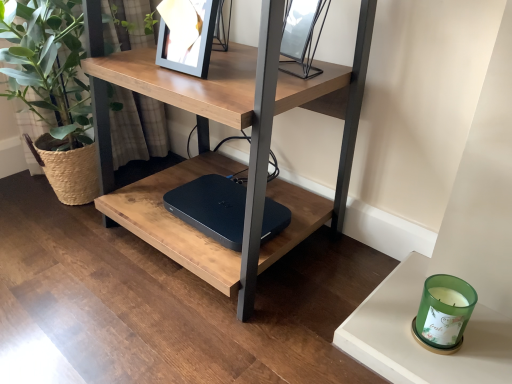
Find the location of a particular element. free spot in front of matte wood table at center is located at coordinates point(188,336).